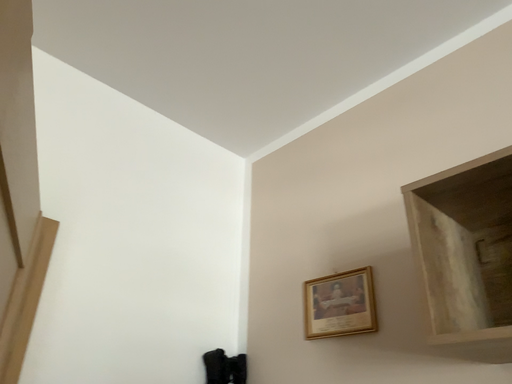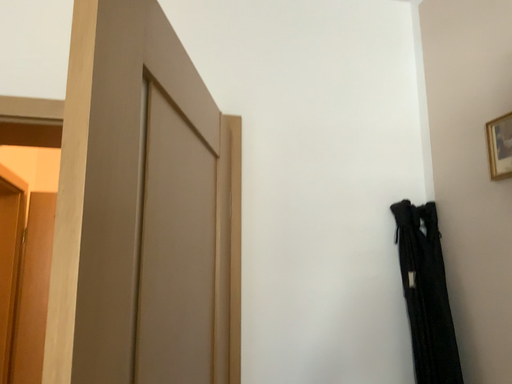
Question: Which way did the camera rotate in the video?

Choices:
 (A) rotated right
 (B) rotated left

Answer: (B)